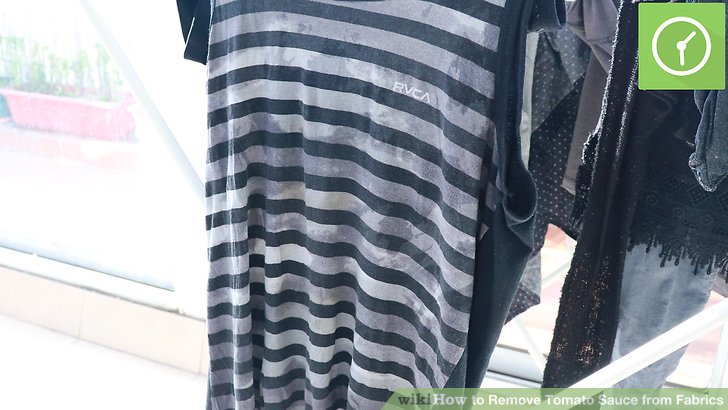
This screenshot has width=728, height=410. I want to click on window sill, so click(105, 304).